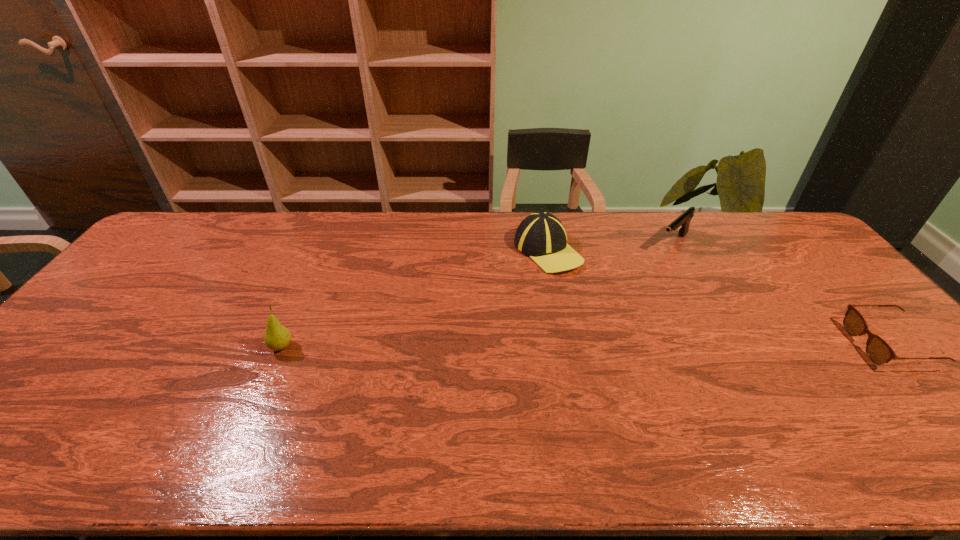
Find the location of a particular element. This screenshot has width=960, height=540. pear is located at coordinates (277, 337).

This screenshot has height=540, width=960. Find the location of `the leftmost object`. the leftmost object is located at coordinates (277, 337).

Where is `the shortest object`? the shortest object is located at coordinates (878, 351).

In order to click on the rightmost object in this screenshot , I will do `click(878, 351)`.

The width and height of the screenshot is (960, 540). I want to click on baseball cap, so click(541, 236).

Identify the location of the third object from left to right. The image size is (960, 540). (683, 221).

This screenshot has height=540, width=960. Identify the location of blank space located on the right of the pear. (382, 347).

Image resolution: width=960 pixels, height=540 pixels. I want to click on blank area located 0.060m at the front view of the rightmost object, so (835, 345).

The width and height of the screenshot is (960, 540). Find the location of `free space located at the front view of the rightmost object`. free space located at the front view of the rightmost object is located at coordinates (778, 345).

This screenshot has height=540, width=960. In order to click on vacant space located at the front view of the rightmost object in this screenshot , I will do (x=778, y=345).